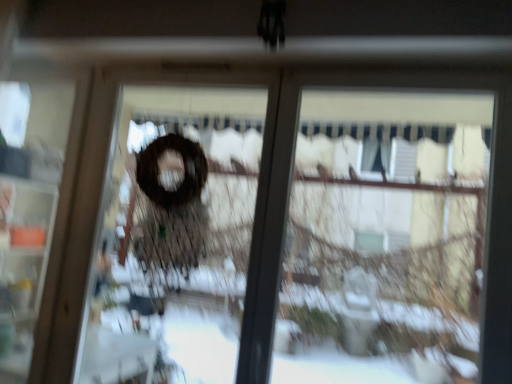
What do you see at coordinates (198, 240) in the screenshot?
I see `brown matte wreath at center, marked as the first screen door in a right-to-left arrangement` at bounding box center [198, 240].

The height and width of the screenshot is (384, 512). Describe the element at coordinates (385, 238) in the screenshot. I see `transparent glass at center` at that location.

The image size is (512, 384). What are the coordinates of `transparent plastic screen door at left, placed as the 1th screen door when sorted from left to right` in the screenshot? It's located at (28, 204).

Where is `brown matte wreath at center, arranged as the 2th screen door when viewed from the left`? The image size is (512, 384). brown matte wreath at center, arranged as the 2th screen door when viewed from the left is located at coordinates (198, 240).

From the picture: Is brown matte wreath at center, arranged as the 2th screen door when viewed from the left, not within transparent glass at center?

Yes, brown matte wreath at center, arranged as the 2th screen door when viewed from the left, is outside of transparent glass at center.

Is brown matte wreath at center, marked as the first screen door in a right-to-left arrangement, oriented away from transparent glass at center?

No, brown matte wreath at center, marked as the first screen door in a right-to-left arrangement,'s orientation is not away from transparent glass at center.

Based on the photo, how much distance is there between brown matte wreath at center, marked as the first screen door in a right-to-left arrangement, and transparent glass at center?

The distance of brown matte wreath at center, marked as the first screen door in a right-to-left arrangement, from transparent glass at center is 5.17 feet.

Does brown matte wreath at center, arranged as the 2th screen door when viewed from the left, appear on the left side of transparent glass at center?

Correct, you'll find brown matte wreath at center, arranged as the 2th screen door when viewed from the left, to the left of transparent glass at center.

Looking at their sizes, would you say transparent glass at center is wider or thinner than brown matte wreath at center, arranged as the 2th screen door when viewed from the left?

Clearly, transparent glass at center has more width compared to brown matte wreath at center, arranged as the 2th screen door when viewed from the left.

From a real-world perspective, does transparent glass at center stand above brown matte wreath at center, marked as the first screen door in a right-to-left arrangement?

Yes, from a real-world perspective, transparent glass at center is above brown matte wreath at center, marked as the first screen door in a right-to-left arrangement.

Locate an element on the screen. screen door below the transparent glass at center (from the image's perspective) is located at coordinates (198, 240).

Is transparent glass at center shorter than brown matte wreath at center, marked as the first screen door in a right-to-left arrangement?

Correct, transparent glass at center is not as tall as brown matte wreath at center, marked as the first screen door in a right-to-left arrangement.

Which object is thinner, brown matte wreath at center, arranged as the 2th screen door when viewed from the left, or transparent plastic screen door at left, placed as the 1th screen door when sorted from left to right?

brown matte wreath at center, arranged as the 2th screen door when viewed from the left.

Considering their positions, is brown matte wreath at center, arranged as the 2th screen door when viewed from the left, located in front of or behind transparent plastic screen door at left, placed as the 1th screen door when sorted from left to right?

brown matte wreath at center, arranged as the 2th screen door when viewed from the left, is in front of transparent plastic screen door at left, placed as the 1th screen door when sorted from left to right.

From a real-world perspective, which is physically above, brown matte wreath at center, arranged as the 2th screen door when viewed from the left, or transparent plastic screen door at left, the 2th screen door from the right?

brown matte wreath at center, arranged as the 2th screen door when viewed from the left, is physically above.

Visually, is brown matte wreath at center, arranged as the 2th screen door when viewed from the left, positioned to the left or to the right of transparent plastic screen door at left, placed as the 1th screen door when sorted from left to right?

brown matte wreath at center, arranged as the 2th screen door when viewed from the left, is to the right of transparent plastic screen door at left, placed as the 1th screen door when sorted from left to right.

From the image's perspective, is transparent glass at center above or below transparent plastic screen door at left, placed as the 1th screen door when sorted from left to right?

Clearly, from the image's perspective, transparent glass at center is below transparent plastic screen door at left, placed as the 1th screen door when sorted from left to right.

From a real-world perspective, between transparent glass at center and transparent plastic screen door at left, placed as the 1th screen door when sorted from left to right, who is vertically higher?

transparent glass at center.

In terms of width, does transparent glass at center look wider or thinner when compared to transparent plastic screen door at left, the 2th screen door from the right?

transparent glass at center is wider than transparent plastic screen door at left, the 2th screen door from the right.

At what (x,y) coordinates should I click in order to perform the action: click on screen door located in front of the transparent plastic screen door at left, placed as the 1th screen door when sorted from left to right. Please return your answer as a coordinate pair (x, y). Looking at the image, I should click on pos(198,240).

Considering the relative positions of transparent plastic screen door at left, the 2th screen door from the right, and brown matte wreath at center, arranged as the 2th screen door when viewed from the left, in the image provided, is transparent plastic screen door at left, the 2th screen door from the right, in front of brown matte wreath at center, arranged as the 2th screen door when viewed from the left,?

No, it is not.

Is transparent plastic screen door at left, placed as the 1th screen door when sorted from left to right, facing away from brown matte wreath at center, arranged as the 2th screen door when viewed from the left?

That's not correct — transparent plastic screen door at left, placed as the 1th screen door when sorted from left to right, is not looking away from brown matte wreath at center, arranged as the 2th screen door when viewed from the left.

Which of these two, transparent plastic screen door at left, the 2th screen door from the right, or transparent glass at center, is thinner?

transparent plastic screen door at left, the 2th screen door from the right, is thinner.

Is transparent plastic screen door at left, placed as the 1th screen door when sorted from left to right, oriented away from transparent glass at center?

No.

From the image's perspective, is transparent plastic screen door at left, the 2th screen door from the right, positioned above or below transparent glass at center?

Clearly, from the image's perspective, transparent plastic screen door at left, the 2th screen door from the right, is above transparent glass at center.

At what (x,y) coordinates should I click in order to perform the action: click on shop window that appears above the brown matte wreath at center, arranged as the 2th screen door when viewed from the left (from the image's perspective). Please return your answer as a coordinate pair (x, y). Looking at the image, I should click on (385, 238).

Where is `screen door that is the 1st object located behind the transparent glass at center`? The width and height of the screenshot is (512, 384). screen door that is the 1st object located behind the transparent glass at center is located at coordinates (198, 240).

From the image, which object appears to be farther from transparent glass at center, transparent plastic screen door at left, placed as the 1th screen door when sorted from left to right, or brown matte wreath at center, arranged as the 2th screen door when viewed from the left?

The object further to transparent glass at center is transparent plastic screen door at left, placed as the 1th screen door when sorted from left to right.

Looking at the image, which one is located further to brown matte wreath at center, arranged as the 2th screen door when viewed from the left, transparent glass at center or transparent plastic screen door at left, the 2th screen door from the right?

transparent glass at center is positioned further to the anchor brown matte wreath at center, arranged as the 2th screen door when viewed from the left.

When comparing their distances from transparent glass at center, does brown matte wreath at center, marked as the first screen door in a right-to-left arrangement, or transparent plastic screen door at left, the 2th screen door from the right, seem further?

transparent plastic screen door at left, the 2th screen door from the right.

Considering their positions, is brown matte wreath at center, arranged as the 2th screen door when viewed from the left, positioned further to transparent plastic screen door at left, the 2th screen door from the right, than transparent glass at center?

The object further to transparent plastic screen door at left, the 2th screen door from the right, is transparent glass at center.

Looking at the image, which one is located further to brown matte wreath at center, arranged as the 2th screen door when viewed from the left, transparent plastic screen door at left, placed as the 1th screen door when sorted from left to right, or transparent glass at center?

The object further to brown matte wreath at center, arranged as the 2th screen door when viewed from the left, is transparent glass at center.

When comparing their distances from transparent plastic screen door at left, placed as the 1th screen door when sorted from left to right, does transparent glass at center or brown matte wreath at center, arranged as the 2th screen door when viewed from the left, seem further?

→ transparent glass at center is further to transparent plastic screen door at left, placed as the 1th screen door when sorted from left to right.

You are a GUI agent. You are given a task and a screenshot of the screen. Output one action in this format:
    pyautogui.click(x=<x>, y=<y>)
    Task: Click on the screen door between transparent plastic screen door at left, the 2th screen door from the right, and transparent glass at center
    This screenshot has height=384, width=512.
    Given the screenshot: What is the action you would take?
    coord(198,240)